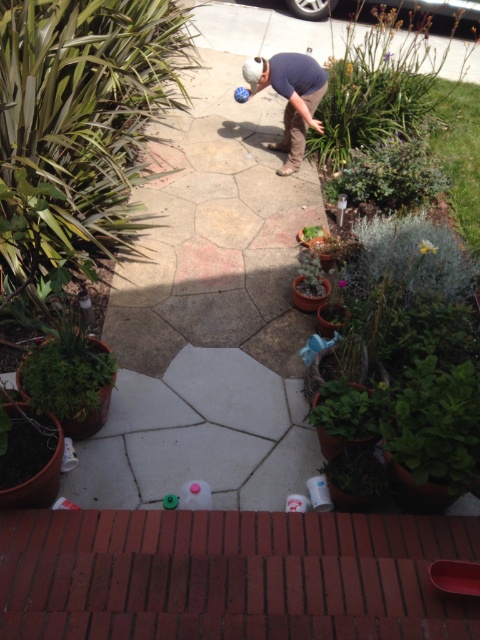
Can you confirm if yellow matte flower at center is smaller than purple matte flower at upper center?

Correct, yellow matte flower at center occupies less space than purple matte flower at upper center.

Is point (433, 244) less distant than point (388, 51)?

Yes.

What do you see at coordinates (427, 246) in the screenshot? Image resolution: width=480 pixels, height=640 pixels. I see `yellow matte flower at center` at bounding box center [427, 246].

You are a GUI agent. You are given a task and a screenshot of the screen. Output one action in this format:
    pyautogui.click(x=<x>, y=<y>)
    Task: Click on the yellow matte flower at center
    Image resolution: width=480 pixels, height=640 pixels.
    Given the screenshot: What is the action you would take?
    pyautogui.click(x=427, y=246)

Is point (273, 65) positioned in front of point (388, 54)?

Yes, point (273, 65) is in front of point (388, 54).

Is the position of matte blue shirt at center more distant than that of purple matte flower at upper center?

That is False.

The width and height of the screenshot is (480, 640). Identify the location of matte blue shirt at center. (289, 97).

Can you confirm if green leafy plant at upper right is taller than matte blue shirt at center?

Yes, green leafy plant at upper right is taller than matte blue shirt at center.

Where is `green leafy plant at upper right`? This screenshot has height=640, width=480. green leafy plant at upper right is located at coordinates (376, 84).